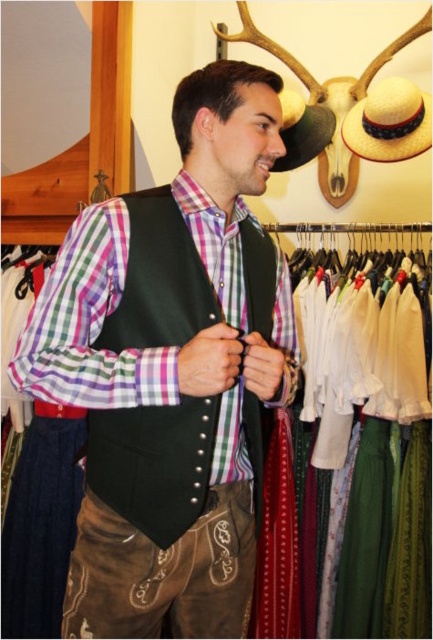
You are a customer in the store and want to try on the natural straw hat at upper right. The black leather vest at center is blocking your path. Can you move the vest to reach the hat?

The black leather vest at center is to the left of natural straw hat at upper right, so you can move the vest to the right to access the hat.

You are a customer in a traditional clothing store. You see the matte black vest at center and the natural straw hat at upper right. Which item is bigger in size?

The matte black vest at center is larger in size compared to the natural straw hat at upper right.